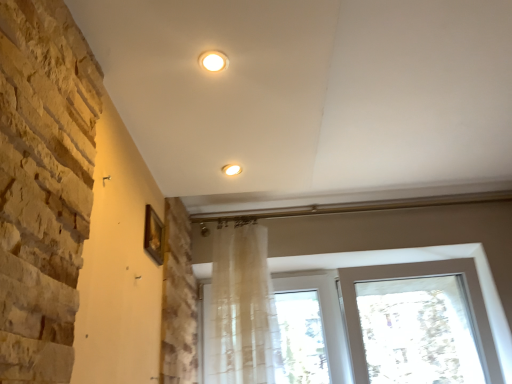
Question: Is transparent fabric at bottom taller or shorter than matte white light fixture at upper center, which appears as the first lighting when viewed from the front?

Choices:
 (A) tall
 (B) short

Answer: (A)

Question: Looking at their shapes, would you say transparent fabric at bottom is wider or thinner than matte white light fixture at upper center, marked as the first lighting in a top-to-bottom arrangement?

Choices:
 (A) thin
 (B) wide

Answer: (B)

Question: Which of these objects is positioned closest to the translucent fabric shower curtain at center?

Choices:
 (A) wooden picture frame at upper left
 (B) natural stone wall at left
 (C) matte white light fixture at center, marked as the 2th lighting in a top-to-bottom arrangement
 (D) transparent fabric at bottom
 (E) matte white light fixture at upper center, the 2th lighting viewed from the back

Answer: (D)

Question: Which object is the closest to the translucent fabric shower curtain at center?

Choices:
 (A) wooden picture frame at upper left
 (B) matte white light fixture at center, positioned as the 1th lighting in back-to-front order
 (C) natural stone wall at left
 (D) transparent fabric at bottom
 (E) matte white light fixture at upper center, which appears as the first lighting when viewed from the front

Answer: (D)